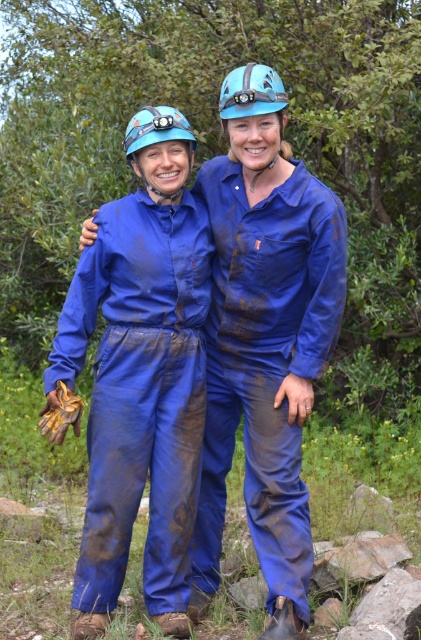
You are standing at the origin point in the image. Which of the two points, point (191,148) or point (234,93), is closer to you?

Point (234,93) is closer to you because it is in front of point (191,148).

You are a safety inspector checking the equipment of two workers. The blue matte jumpsuit at left and the matte blue helmet at upper center are part of their gear. Which piece of equipment has a greater width?

The blue matte jumpsuit at left has a greater width than the matte blue helmet at upper center according to the description.